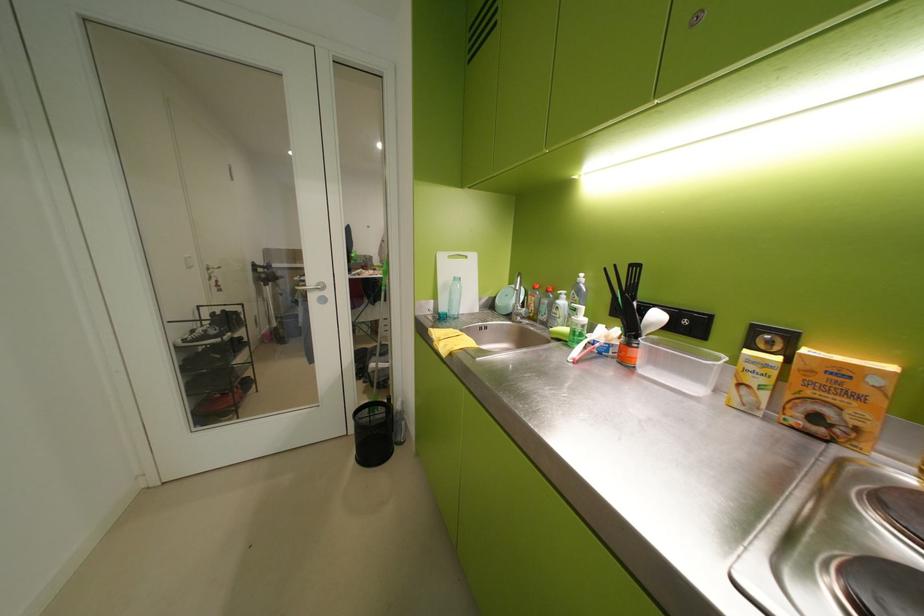
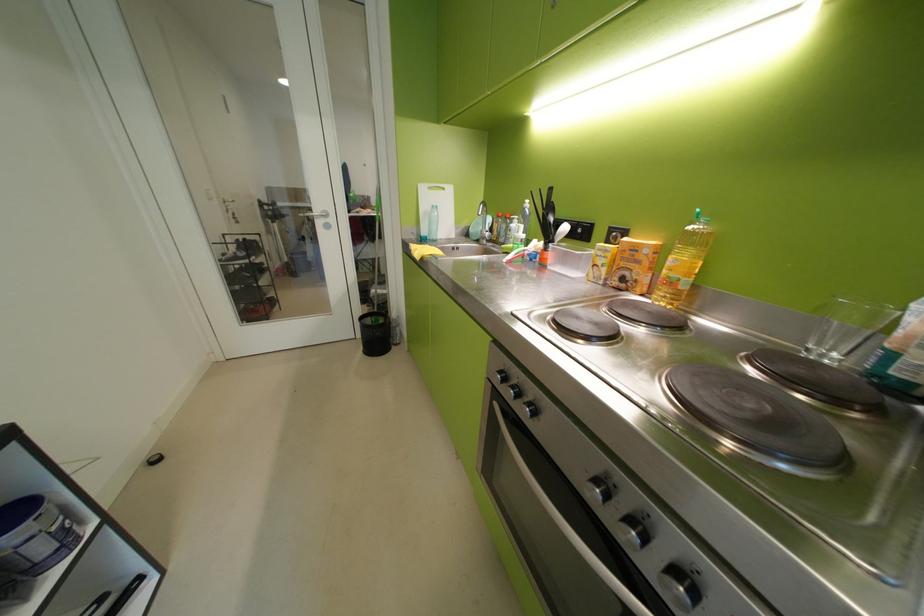
In the second image, find the point that corresponds to the point at 363,432 in the first image.

(370, 336)